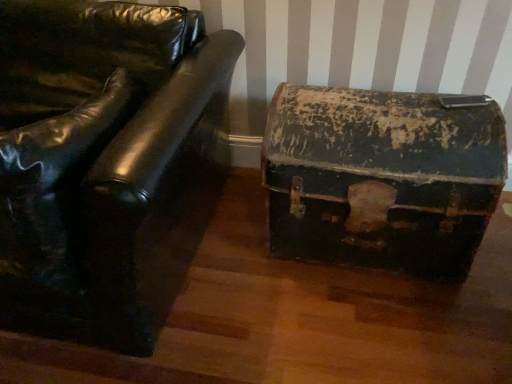
Image resolution: width=512 pixels, height=384 pixels. Find the location of `rusty metal trunk at right`. rusty metal trunk at right is located at coordinates (382, 177).

This screenshot has height=384, width=512. What do you see at coordinates (382, 177) in the screenshot?
I see `rusty metal trunk at right` at bounding box center [382, 177].

Locate an element on the screen. The height and width of the screenshot is (384, 512). matte black leather couch at left is located at coordinates (105, 163).

Describe the element at coordinates (105, 163) in the screenshot. I see `matte black leather couch at left` at that location.

This screenshot has height=384, width=512. I want to click on rusty metal trunk at right, so point(382,177).

In the image, is rusty metal trunk at right on the left side or the right side of matte black leather couch at left?

From the image, it's evident that rusty metal trunk at right is to the right of matte black leather couch at left.

Which object is further away from the camera, rusty metal trunk at right or matte black leather couch at left?

rusty metal trunk at right is further away from the camera.

Which is in front, point (445, 271) or point (78, 45)?

Positioned in front is point (78, 45).

Looking at this image, from the image's perspective, is rusty metal trunk at right located above or below matte black leather couch at left?

rusty metal trunk at right is below matte black leather couch at left.

From a real-world perspective, is rusty metal trunk at right under matte black leather couch at left?

Yes.

In terms of width, does rusty metal trunk at right look wider or thinner when compared to matte black leather couch at left?

rusty metal trunk at right is thinner than matte black leather couch at left.

Is rusty metal trunk at right taller or shorter than matte black leather couch at left?

In the image, rusty metal trunk at right appears to be shorter than matte black leather couch at left.

Is rusty metal trunk at right bigger or smaller than matte black leather couch at left?

Considering their sizes, rusty metal trunk at right takes up less space than matte black leather couch at left.

Does rusty metal trunk at right contain matte black leather couch at left?

No, rusty metal trunk at right does not contain matte black leather couch at left.

Is rusty metal trunk at right next to matte black leather couch at left and touching it?

rusty metal trunk at right and matte black leather couch at left are clearly separated.

Is rusty metal trunk at right oriented towards matte black leather couch at left?

No, rusty metal trunk at right is not aimed at matte black leather couch at left.

What's the angular difference between rusty metal trunk at right and matte black leather couch at left's facing directions?

There is a 1.64-degree angle between the facing directions of rusty metal trunk at right and matte black leather couch at left.

Find the location of a particular element. The image size is (512, 384). furniture above the rusty metal trunk at right (from the image's perspective) is located at coordinates (105, 163).

Between matte black leather couch at left and rusty metal trunk at right, which one appears on the left side from the viewer's perspective?

Positioned to the left is matte black leather couch at left.

Is matte black leather couch at left behind rusty metal trunk at right?

No, it is not.

Is point (89, 271) farther from viewer compared to point (402, 123)?

No, it is in front of (402, 123).

From the image's perspective, would you say matte black leather couch at left is shown under rusty metal trunk at right?

Incorrect, from the image's perspective, matte black leather couch at left is higher than rusty metal trunk at right.

From a real-world perspective, which is physically below, matte black leather couch at left or rusty metal trunk at right?

From a 3D spatial view, rusty metal trunk at right is below.

In terms of width, does matte black leather couch at left look wider or thinner when compared to rusty metal trunk at right?

Considering their sizes, matte black leather couch at left looks broader than rusty metal trunk at right.

Based on the photo, in terms of height, does matte black leather couch at left look taller or shorter compared to rusty metal trunk at right?

Considering their sizes, matte black leather couch at left has more height than rusty metal trunk at right.

Is matte black leather couch at left bigger than rusty metal trunk at right?

Correct, matte black leather couch at left is larger in size than rusty metal trunk at right.

Can we say matte black leather couch at left lies outside rusty metal trunk at right?

Yes.

Are matte black leather couch at left and rusty metal trunk at right far apart?

Actually, matte black leather couch at left and rusty metal trunk at right are a little close together.

Is matte black leather couch at left positioned with its back to rusty metal trunk at right?

No.

Locate an element on the screen. Image resolution: width=512 pixels, height=384 pixels. storage box behind the matte black leather couch at left is located at coordinates (382, 177).

In the image, there is a rusty metal trunk at right. Where is `furniture above it (from the image's perspective)`? Image resolution: width=512 pixels, height=384 pixels. furniture above it (from the image's perspective) is located at coordinates (105, 163).

Find the location of `furniture above the rusty metal trunk at right (from a real-world perspective)`. furniture above the rusty metal trunk at right (from a real-world perspective) is located at coordinates (105, 163).